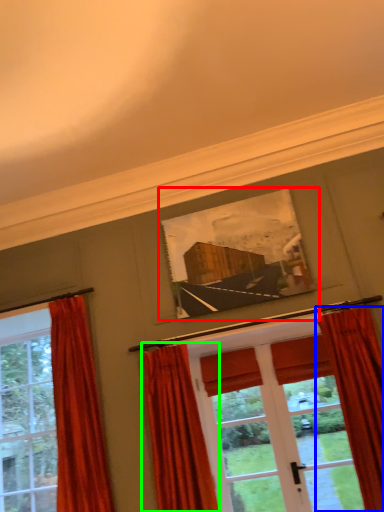
Question: Based on their relative distances, which object is nearer to picture frame (highlighted by a red box)? Choose from curtain (highlighted by a blue box) and curtain (highlighted by a green box).

Choices:
 (A) curtain
 (B) curtain

Answer: (A)